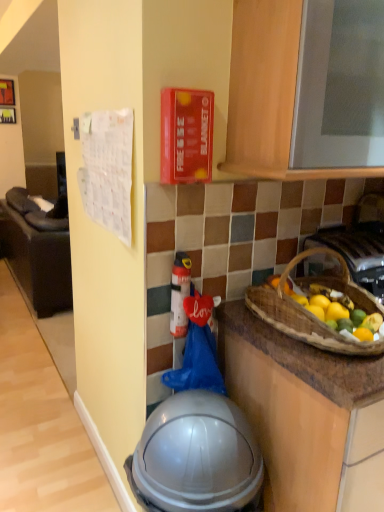
Question: Is metallic silver gas stove at right not near white fabric calendar at left?

Choices:
 (A) yes
 (B) no

Answer: (A)

Question: Does metallic silver gas stove at right have a lesser width compared to white fabric calendar at left?

Choices:
 (A) yes
 (B) no

Answer: (A)

Question: Considering the relative sizes of metallic silver gas stove at right and white fabric calendar at left in the image provided, is metallic silver gas stove at right bigger than white fabric calendar at left?

Choices:
 (A) no
 (B) yes

Answer: (A)

Question: Is metallic silver gas stove at right behind white fabric calendar at left?

Choices:
 (A) no
 (B) yes

Answer: (A)

Question: Is metallic silver gas stove at right aimed at white fabric calendar at left?

Choices:
 (A) no
 (B) yes

Answer: (A)

Question: Is white fabric calendar at left at the back of metallic silver gas stove at right?

Choices:
 (A) no
 (B) yes

Answer: (B)

Question: Does brown woven basket at right have a greater height compared to white fabric calendar at left?

Choices:
 (A) yes
 (B) no

Answer: (B)

Question: Is brown woven basket at right smaller than white fabric calendar at left?

Choices:
 (A) yes
 (B) no

Answer: (A)

Question: Does brown woven basket at right touch white fabric calendar at left?

Choices:
 (A) yes
 (B) no

Answer: (B)

Question: Is brown woven basket at right at the left side of white fabric calendar at left?

Choices:
 (A) yes
 (B) no

Answer: (B)

Question: From a real-world perspective, is brown woven basket at right beneath white fabric calendar at left?

Choices:
 (A) yes
 (B) no

Answer: (B)

Question: Does brown woven basket at right turn towards white fabric calendar at left?

Choices:
 (A) yes
 (B) no

Answer: (B)

Question: Considering the relative positions of wooden cabinet at upper center and transparent plastic helmet at lower center in the image provided, is wooden cabinet at upper center to the left of transparent plastic helmet at lower center from the viewer's perspective?

Choices:
 (A) no
 (B) yes

Answer: (A)